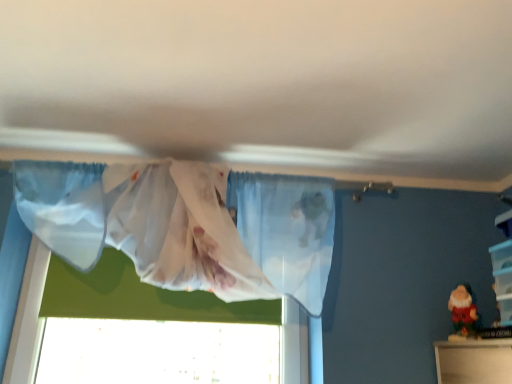
Question: In the image, is matte plastic santa at lower right positioned in front of or behind clear plastic storage at right?

Choices:
 (A) front
 (B) behind

Answer: (B)

Question: From the image's perspective, relative to clear plastic storage at right, is matte plastic santa at lower right above or below?

Choices:
 (A) above
 (B) below

Answer: (B)

Question: Which object is the farthest from the matte plastic santa at lower right?

Choices:
 (A) translucent fabric curtain at upper center
 (B) clear plastic storage at right

Answer: (A)

Question: Based on their relative distances, which object is nearer to the clear plastic storage at right?

Choices:
 (A) matte plastic santa at lower right
 (B) translucent fabric curtain at upper center

Answer: (A)